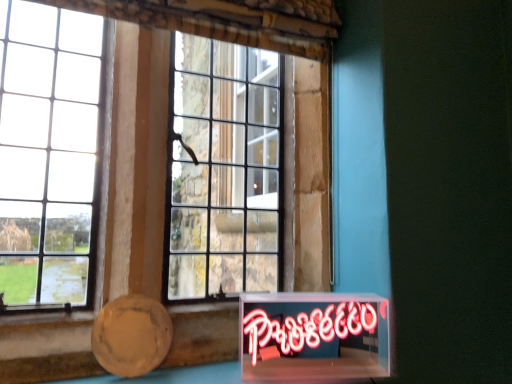
The height and width of the screenshot is (384, 512). What do you see at coordinates (47, 153) in the screenshot? I see `clear glass window at center` at bounding box center [47, 153].

Where is `clear glass window at center`? clear glass window at center is located at coordinates (47, 153).

The width and height of the screenshot is (512, 384). I want to click on clear glass window at center, so click(x=47, y=153).